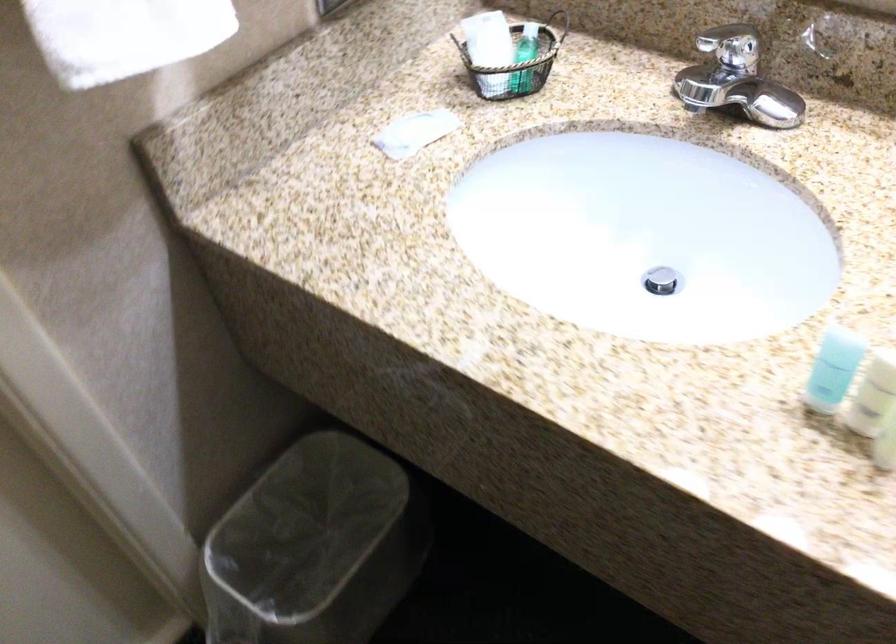
The image size is (896, 644). What do you see at coordinates (730, 44) in the screenshot?
I see `a faucet handle` at bounding box center [730, 44].